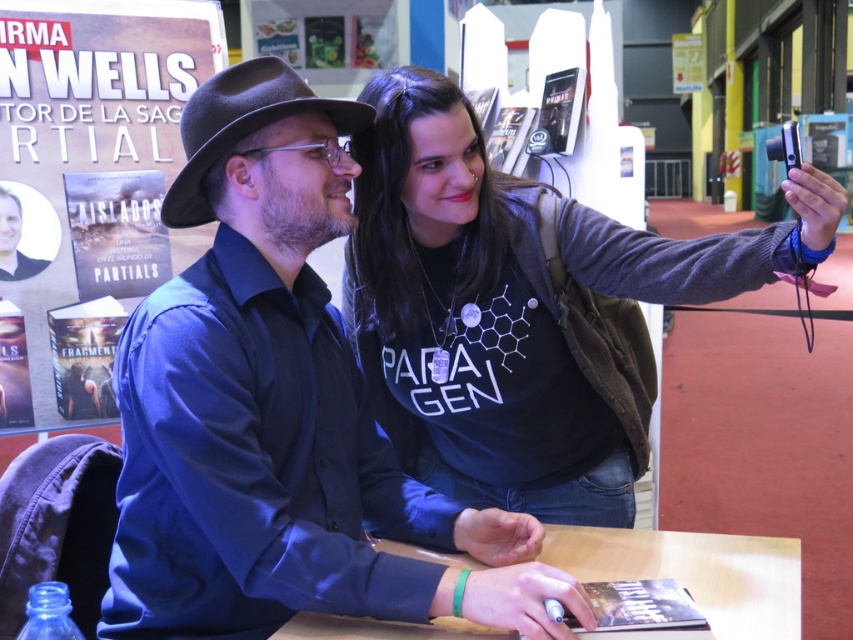
Does point (13, 180) come behind point (271, 104)?

That is True.

Image resolution: width=853 pixels, height=640 pixels. I want to click on matte black book at upper left, so click(86, 188).

Looking at this image, which of these two, dark gray sweater at upper right or black felt fedora at upper center, stands taller?

With more height is dark gray sweater at upper right.

Find the location of a particular element. Image resolution: width=853 pixels, height=640 pixels. dark gray sweater at upper right is located at coordinates (480, 323).

Where is `dark gray sweater at upper right`? The height and width of the screenshot is (640, 853). dark gray sweater at upper right is located at coordinates (480, 323).

Find the location of a particular element. This screenshot has height=640, width=853. dark gray sweater at upper right is located at coordinates (480, 323).

Does wooden table at center have a lesser height compared to black felt fedora at upper center?

Correct, wooden table at center is not as tall as black felt fedora at upper center.

Is wooden table at center to the right of black felt fedora at upper center from the viewer's perspective?

Yes, wooden table at center is to the right of black felt fedora at upper center.

Image resolution: width=853 pixels, height=640 pixels. I want to click on wooden table at center, so click(695, 572).